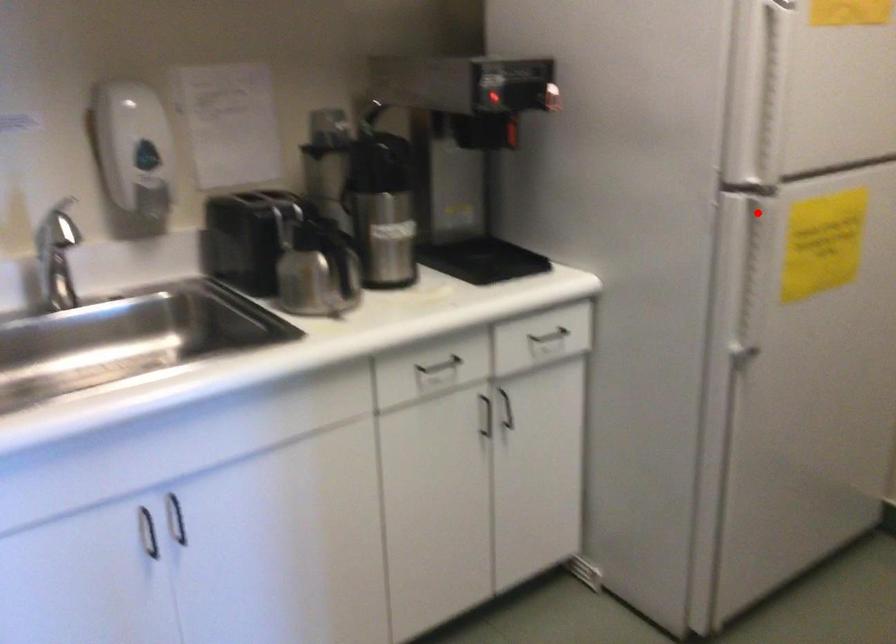
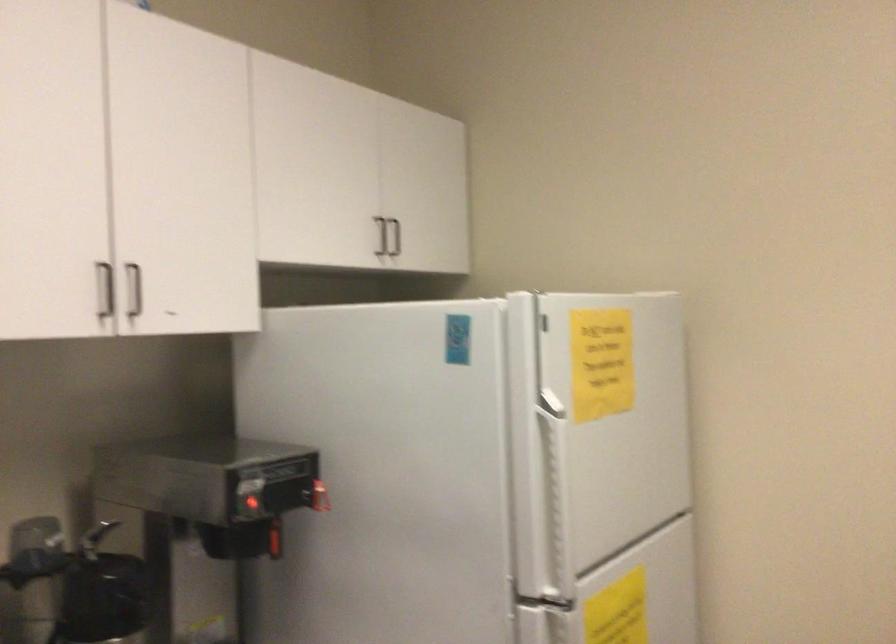
Question: I am providing you with two images of the same scene from different viewpoints. In image1, a red point is highlighted. Considering the same 3D point in image2, which of the following is correct?

Choices:
 (A) It is closer
 (B) It is farther

Answer: (A)